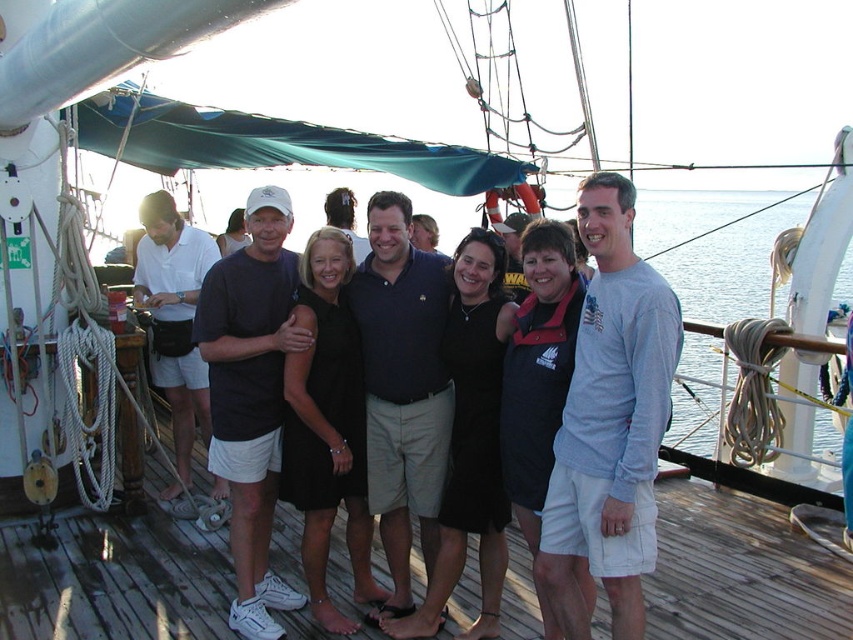
Question: Which of the following is the farthest from the observer?

Choices:
 (A) light blue long-sleeve shirt at center
 (B) wooden deck at center
 (C) dark blue polo shirt at center

Answer: (B)

Question: Estimate the real-world distances between objects in this image. Which object is closer to the light blue long-sleeve shirt at center?

Choices:
 (A) wooden deck at center
 (B) dark blue polo shirt at center

Answer: (B)

Question: Which object is farther from the camera taking this photo?

Choices:
 (A) dark blue shirt at center
 (B) matte white shirt at left
 (C) wooden deck at center
 (D) light blue long-sleeve shirt at center

Answer: (B)

Question: Is wooden deck at center above matte white shirt at left?

Choices:
 (A) yes
 (B) no

Answer: (B)

Question: Observing the image, what is the correct spatial positioning of wooden deck at center in reference to matte white shirt at left?

Choices:
 (A) below
 (B) above

Answer: (A)

Question: Is dark blue t-shirt at center to the right of dark blue polo shirt at center from the viewer's perspective?

Choices:
 (A) yes
 (B) no

Answer: (B)